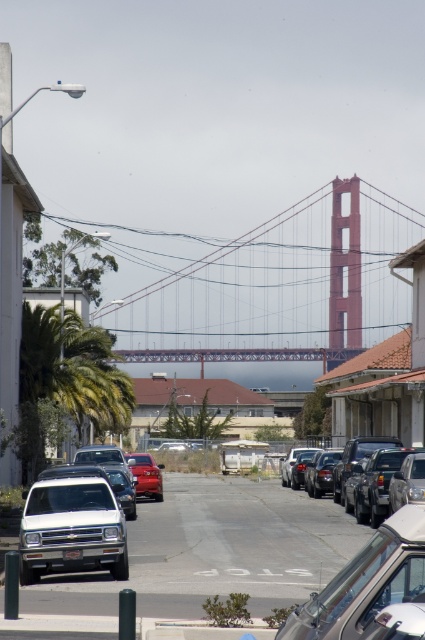
Is clear glass car at center in front of shiny red sedan at center?

Yes.

Where is `clear glass car at center`? clear glass car at center is located at coordinates (365, 580).

Where is `clear glass car at center`? clear glass car at center is located at coordinates (365, 580).

Where is `clear glass car at center`? Image resolution: width=425 pixels, height=640 pixels. clear glass car at center is located at coordinates click(x=365, y=580).

Can you confirm if clear glass car at center is bigger than white matte truck at center?

Yes, clear glass car at center is bigger than white matte truck at center.

Is clear glass car at center behind white matte truck at center?

No, clear glass car at center is in front of white matte truck at center.

The width and height of the screenshot is (425, 640). What do you see at coordinates (365, 580) in the screenshot? I see `clear glass car at center` at bounding box center [365, 580].

Identify the location of clear glass car at center. Image resolution: width=425 pixels, height=640 pixels. (365, 580).

In the scene shown: Who is lower down, white matte truck at center or shiny red sedan at center?

shiny red sedan at center

Can you confirm if white matte truck at center is positioned above shiny red sedan at center?

Yes, white matte truck at center is above shiny red sedan at center.

Where is `white matte truck at center`? The image size is (425, 640). white matte truck at center is located at coordinates (71, 529).

You are a GUI agent. You are given a task and a screenshot of the screen. Output one action in this format:
    pyautogui.click(x=<x>, y=<y>)
    Task: Click on the white matte truck at center
    The image size is (425, 640).
    Given the screenshot: What is the action you would take?
    pyautogui.click(x=71, y=529)